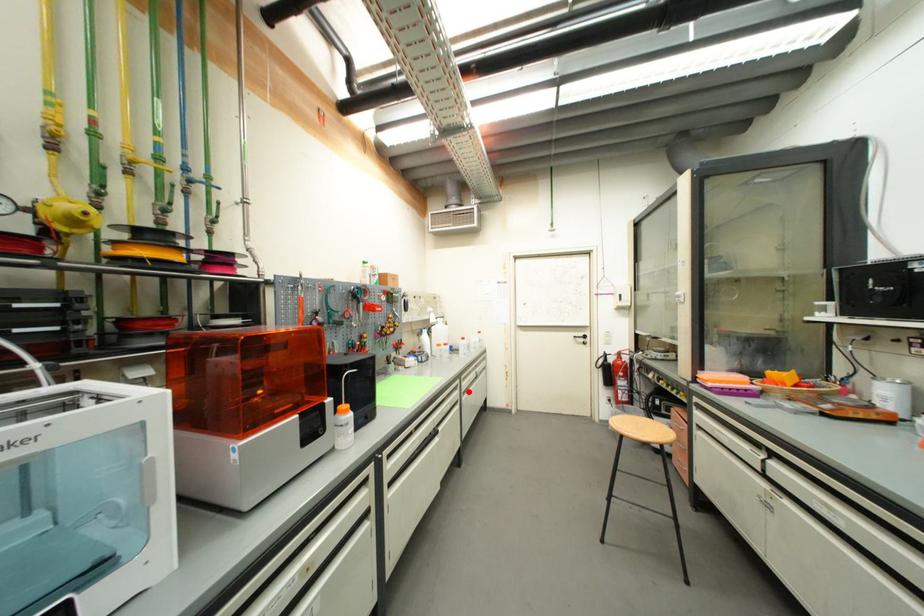
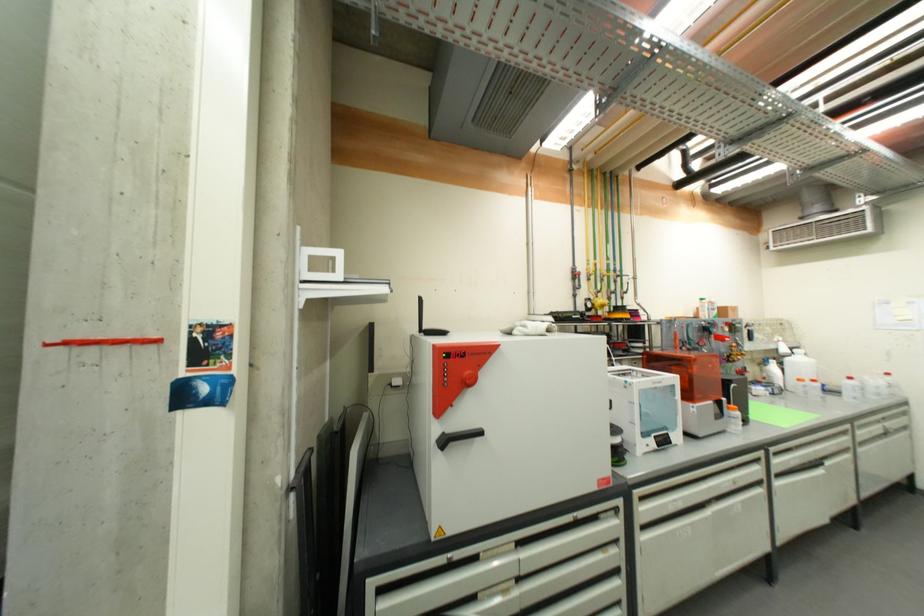
The point at the highlighted location is marked in the first image. Where is the corresponding point in the second image?

(864, 442)